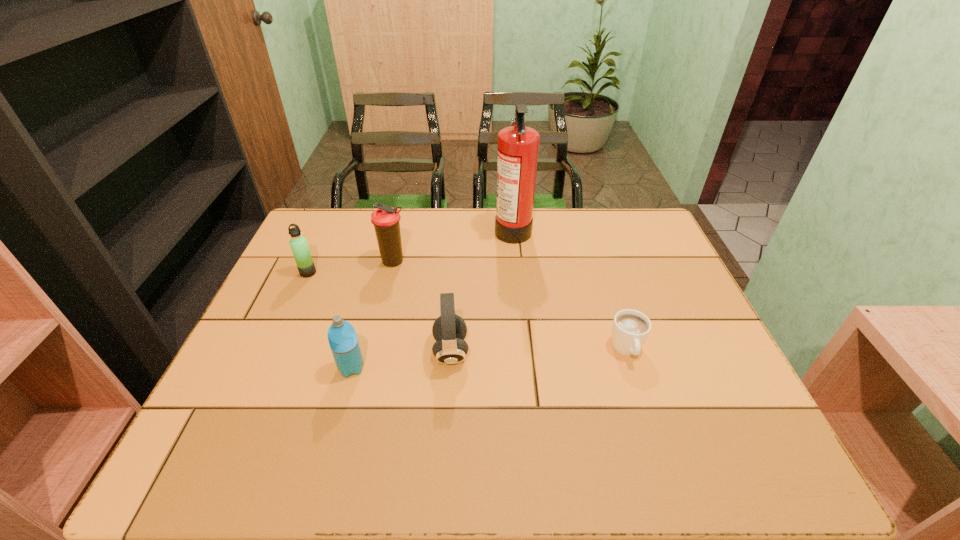
Identify the location of blank region between the farthest object and the tallest thermos bottle. The height and width of the screenshot is (540, 960). (x=453, y=245).

At what (x,y) coordinates should I click in order to perform the action: click on free spot between the nearest thermos bottle and the rightmost object. Please return your answer as a coordinate pair (x, y). Looking at the image, I should click on (489, 359).

Select which object appears as the fifth closest to the third object from right to left. Please provide its 2D coordinates. Your answer should be formatted as a tuple, i.e. [(x, y)], where the tuple contains the x and y coordinates of a point satisfying the conditions above.

[(298, 243)]

Locate an element on the screen. object that stands as the fifth closest to the cappuccino is located at coordinates (298, 243).

Choose which thermos bottle is the second nearest neighbor to the nearest thermos bottle. Please provide its 2D coordinates. Your answer should be formatted as a tuple, i.e. [(x, y)], where the tuple contains the x and y coordinates of a point satisfying the conditions above.

[(298, 243)]

Choose which thermos bottle is the nearest neighbor to the tallest object. Please provide its 2D coordinates. Your answer should be formatted as a tuple, i.e. [(x, y)], where the tuple contains the x and y coordinates of a point satisfying the conditions above.

[(385, 219)]

Where is `free point that satisfies the following two spatial constraints: 1. on the back side of the nearest thermos bottle; 2. on the right side of the tallest thermos bottle`? The image size is (960, 540). free point that satisfies the following two spatial constraints: 1. on the back side of the nearest thermos bottle; 2. on the right side of the tallest thermos bottle is located at coordinates (380, 262).

You are a GUI agent. You are given a task and a screenshot of the screen. Output one action in this format:
    pyautogui.click(x=<x>, y=<y>)
    Task: Click on the vacant area that satisfies the following two spatial constraints: 1. on the back side of the tallest thermos bottle; 2. on the left side of the leftmost thermos bottle
    
    Given the screenshot: What is the action you would take?
    pyautogui.click(x=313, y=262)